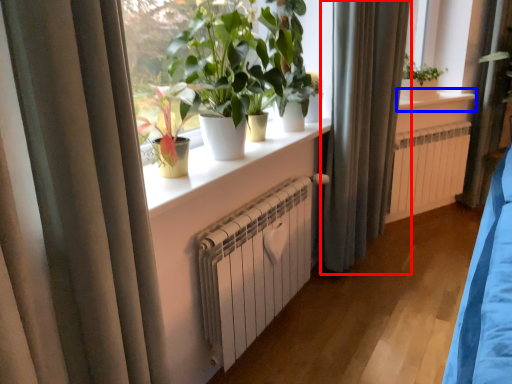
Question: Which point is closer to the camera, curtain (highlighted by a red box) or window sill (highlighted by a blue box)?

Choices:
 (A) curtain
 (B) window sill

Answer: (A)